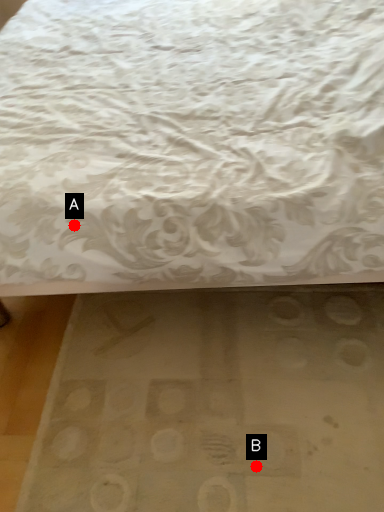
Question: Two points are circled on the image, labeled by A and B beside each circle. Which of the following is the farthest from the observer?

Choices:
 (A) A is further
 (B) B is further

Answer: (B)